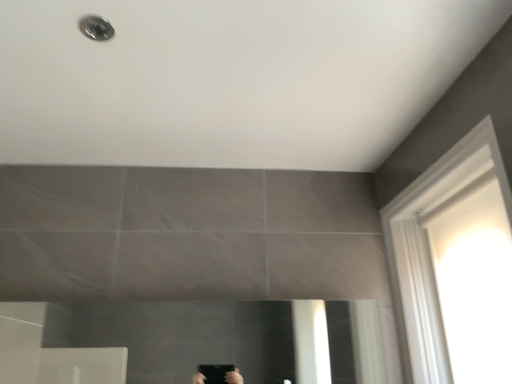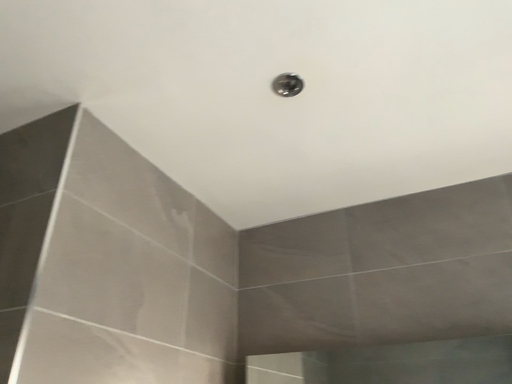
Question: Which way did the camera rotate in the video?

Choices:
 (A) rotated right
 (B) rotated left

Answer: (B)